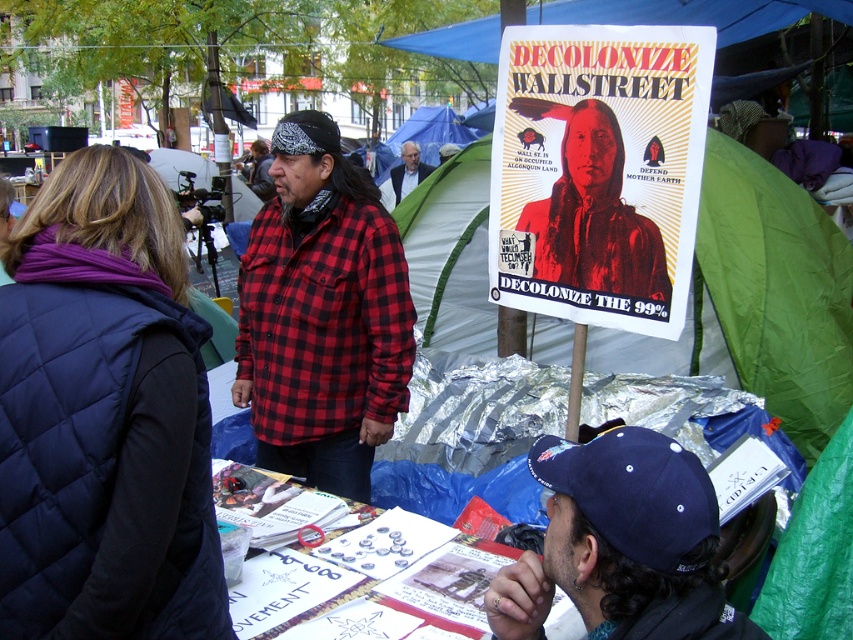
Question: Estimate the real-world distances between objects in this image. Which object is closer to the gray hair at center?

Choices:
 (A) dark blue quilted vest at left
 (B) dark blue baseball cap at lower right

Answer: (A)

Question: Which point is farther to the camera?

Choices:
 (A) (360, 396)
 (B) (650, 461)

Answer: (A)

Question: Is dark blue quilted vest at left further to the viewer compared to red plaid shirt at center?

Choices:
 (A) no
 (B) yes

Answer: (A)

Question: Is white paper poster at center positioned before blue fabric canopy at upper center?

Choices:
 (A) no
 (B) yes

Answer: (B)

Question: Is dark blue fabric baseball cap at lower center below gray hair at center?

Choices:
 (A) no
 (B) yes

Answer: (B)

Question: Considering the real-world distances, which object is farthest from the gray hair at center?

Choices:
 (A) dark blue baseball cap at lower right
 (B) red plaid shirt at center

Answer: (A)